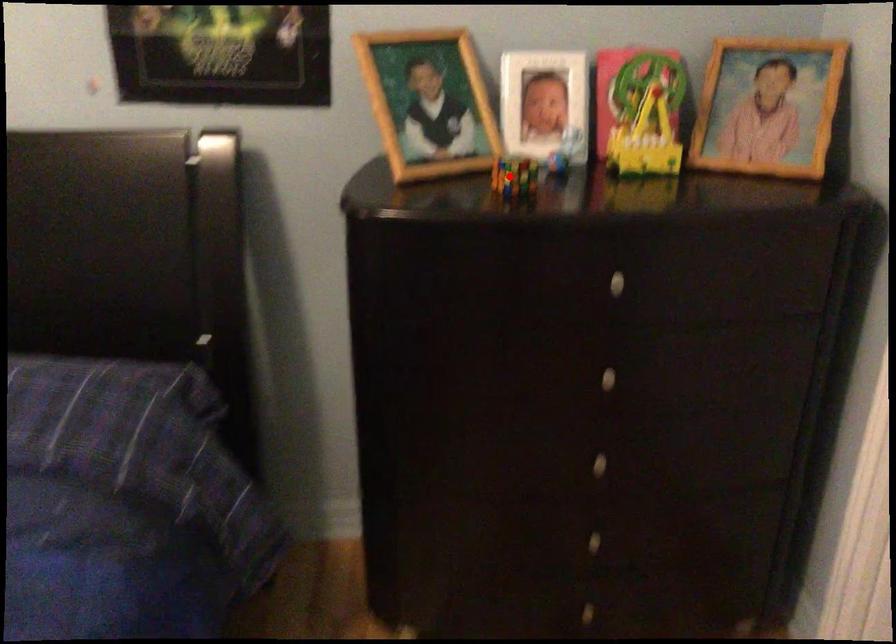
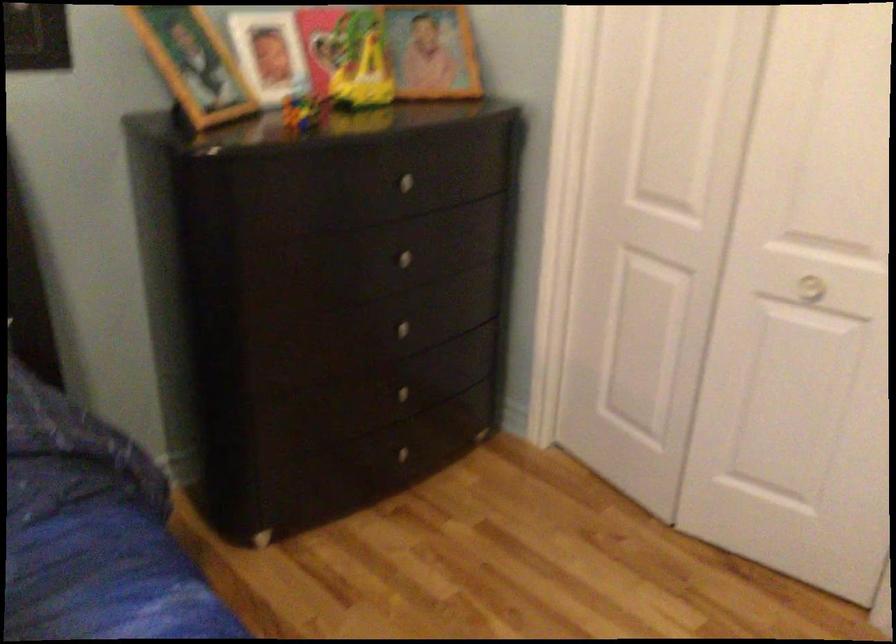
Question: I am providing you with two images of the same scene from different viewpoints. Image1 has a red point marked. In image2, the corresponding 3D location appears at what relative position? Reply with the corresponding letter.

Choices:
 (A) Closer
 (B) Farther

Answer: (B)